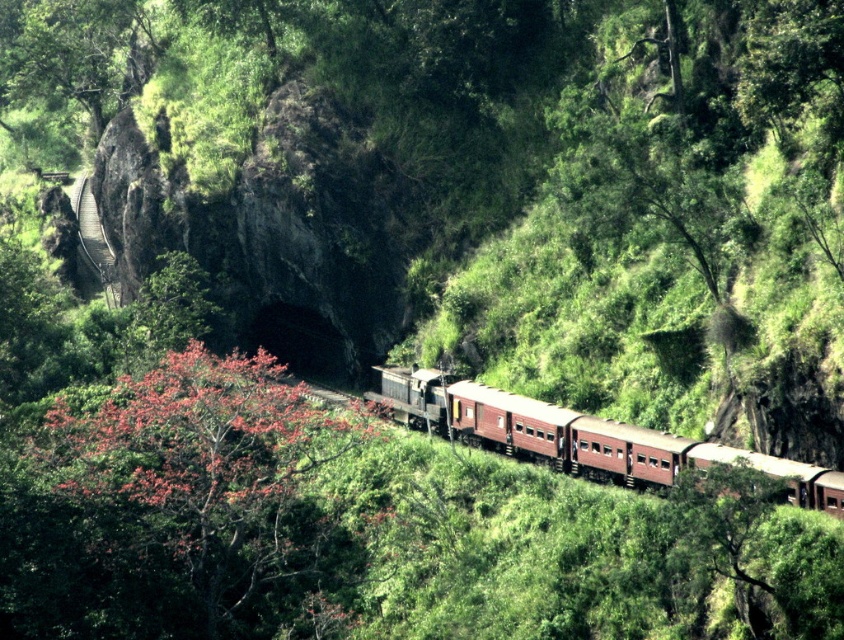
You are a railway engineer assessing the route of the matte brown train at center. Based on its current position, which direction is it heading relative to the tunnel entrance?

The matte brown train at center is positioned at coordinates (582, 436), which places it on the track leading toward the tunnel entrance. Therefore, the train is heading directly toward the tunnel entrance.

You are a passenger on the train and looking out the window. You see the fluffy pink blossoms at center and the metallic train track at left. Which of these two objects is located below the other?

The fluffy pink blossoms at center are positioned under the metallic train track at left, so the blossoms are below the track.